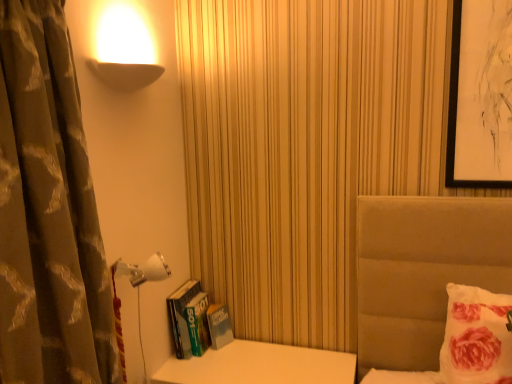
Question: Is the position of hardcover book at left more distant than that of white plastic lamp at lower left?

Choices:
 (A) no
 (B) yes

Answer: (B)

Question: Is hardcover book at left at the left side of white plastic lamp at lower left?

Choices:
 (A) no
 (B) yes

Answer: (A)

Question: Is hardcover book at left far away from white plastic lamp at lower left?

Choices:
 (A) yes
 (B) no

Answer: (B)

Question: Is hardcover book at left in front of white plastic lamp at lower left?

Choices:
 (A) no
 (B) yes

Answer: (A)

Question: Is hardcover book at left looking in the opposite direction of white plastic lamp at lower left?

Choices:
 (A) no
 (B) yes

Answer: (A)

Question: Does point (468, 319) appear closer or farther from the camera than point (227, 316)?

Choices:
 (A) farther
 (B) closer

Answer: (B)

Question: In the image, is fluffy white pillow at right positioned in front of or behind hardcover book at left?

Choices:
 (A) behind
 (B) front

Answer: (B)

Question: Based on their sizes in the image, would you say fluffy white pillow at right is bigger or smaller than hardcover book at left?

Choices:
 (A) big
 (B) small

Answer: (A)

Question: In terms of height, does fluffy white pillow at right look taller or shorter compared to hardcover book at left?

Choices:
 (A) short
 (B) tall

Answer: (B)

Question: From the image's perspective, is fluffy white pillow at right positioned above or below white plastic lamp at lower left?

Choices:
 (A) below
 (B) above

Answer: (A)

Question: Is fluffy white pillow at right in front of or behind white plastic lamp at lower left in the image?

Choices:
 (A) behind
 (B) front

Answer: (B)

Question: Looking at their shapes, would you say fluffy white pillow at right is wider or thinner than white plastic lamp at lower left?

Choices:
 (A) thin
 (B) wide

Answer: (A)

Question: From their relative heights in the image, would you say fluffy white pillow at right is taller or shorter than white plastic lamp at lower left?

Choices:
 (A) short
 (B) tall

Answer: (B)

Question: Would you say hardcover book at left is inside or outside fluffy white pillow at right?

Choices:
 (A) outside
 (B) inside

Answer: (A)

Question: Does point (189, 291) appear closer or farther from the camera than point (465, 311)?

Choices:
 (A) farther
 (B) closer

Answer: (A)